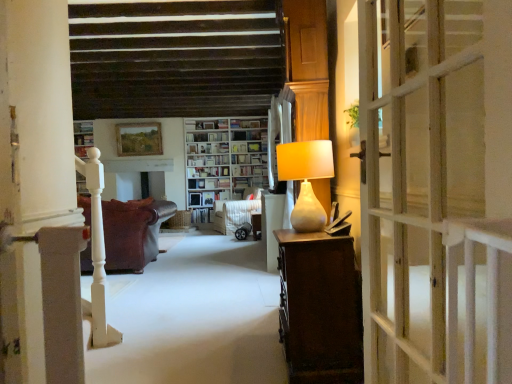
What do you see at coordinates (256, 225) in the screenshot? This screenshot has height=384, width=512. I see `wooden side table at center` at bounding box center [256, 225].

At what (x,y) coordinates should I click in order to perform the action: click on hardcover book at center, the 2th book positioned from the bottom. Please return your answer as a coordinate pair (x, y). Looking at the image, I should click on (208, 171).

Describe the element at coordinates (206, 197) in the screenshot. Image resolution: width=512 pixels, height=384 pixels. I see `hardcover book at center, acting as the first book starting from the bottom` at that location.

The height and width of the screenshot is (384, 512). In order to click on wooden cabinet at right in this screenshot , I will do `click(194, 318)`.

Measure the distance between wooden cabinet at right and camera.

wooden cabinet at right is 6.77 feet away from camera.

Find the location of a particular element. wooden picture frame at upper center is located at coordinates (139, 139).

Is leather couch at left positioned with its back to hardcover book at center, the 2th book positioned from the bottom?

No, hardcover book at center, the 2th book positioned from the bottom, is not at the back of leather couch at left.

Is leather couch at left completely or partially outside of hardcover book at center, the 2th book positioned from the bottom?

leather couch at left lies outside hardcover book at center, the 2th book positioned from the bottom,'s area.

Is leather couch at left next to hardcover book at center, which is counted as the 2th book, starting from the top?

No, leather couch at left is not in contact with hardcover book at center, which is counted as the 2th book, starting from the top.

Which object is further away from the camera, velvet brown armchair at center or hardcover book at center, acting as the first book starting from the bottom?

Positioned behind is hardcover book at center, acting as the first book starting from the bottom.

Could hardcover book at center, the 3th book from the top, be considered to be inside velvet brown armchair at center?

Definitely not — hardcover book at center, the 3th book from the top, is not inside velvet brown armchair at center.

Which of these two, velvet brown armchair at center or hardcover book at center, the 3th book from the top, stands shorter?

hardcover book at center, the 3th book from the top.

From the velvet brown armchair at center, count 1st books backward and point to it. Please provide its 2D coordinates.

[(206, 197)]

Which object is thinner, white wooden door at right or leather couch at left?

white wooden door at right.

Is point (457, 37) closer to viewer compared to point (154, 208)?

Yes, point (457, 37) is closer to viewer.

From a real-world perspective, between white wooden door at right and leather couch at left, who is vertically higher?

white wooden door at right.

Measure the distance from matte beige lamp at right to hardcover book at center, acting as the first book starting from the bottom.

The distance of matte beige lamp at right from hardcover book at center, acting as the first book starting from the bottom, is 4.31 meters.

Which point is more forward, (325, 160) or (218, 195)?

The point (325, 160) is in front.

From the image's perspective, would you say matte beige lamp at right is shown under hardcover book at center, acting as the first book starting from the bottom?

No.

Could you tell me if matte beige lamp at right is facing hardcover book at center, the 3th book from the top?

No, matte beige lamp at right is not aimed at hardcover book at center, the 3th book from the top.

Which object is closer to the camera, white wooden bookcase at center or hardcover book at center, the first book viewed from the top?

Positioned in front is white wooden bookcase at center.

Considering the sizes of white wooden bookcase at center and hardcover book at center, the third book in the bottom-to-top sequence, in the image, is white wooden bookcase at center bigger or smaller than hardcover book at center, the third book in the bottom-to-top sequence,?

white wooden bookcase at center is bigger than hardcover book at center, the third book in the bottom-to-top sequence.

From the image's perspective, is white wooden bookcase at center on hardcover book at center, the third book in the bottom-to-top sequence?

No, from the image's perspective, white wooden bookcase at center is not over hardcover book at center, the third book in the bottom-to-top sequence.

From a real-world perspective, is white wooden bookcase at center on white glossy bookshelf at center, arranged as the second shelf when viewed from the right?

No.

Between white wooden bookcase at center and white glossy bookshelf at center, the first shelf positioned from the top, which one has larger size?

white wooden bookcase at center is bigger.

Is white wooden bookcase at center completely or partially outside of white glossy bookshelf at center, arranged as the second shelf when viewed from the right?

white wooden bookcase at center is positioned outside white glossy bookshelf at center, arranged as the second shelf when viewed from the right.

Considering the relative sizes of white wooden bookcase at center and white glossy bookshelf at center, arranged as the second shelf when viewed from the right, in the image provided, is white wooden bookcase at center wider than white glossy bookshelf at center, arranged as the second shelf when viewed from the right,?

Yes, white wooden bookcase at center is wider than white glossy bookshelf at center, arranged as the second shelf when viewed from the right.

In the scene shown: Are matte beige lamp at right and wooden side table at center beside each other?

matte beige lamp at right and wooden side table at center are not in contact.

Is matte beige lamp at right turned away from wooden side table at center?

That's not correct — matte beige lamp at right is not looking away from wooden side table at center.

Considering the relative sizes of matte beige lamp at right and wooden side table at center in the image provided, is matte beige lamp at right wider than wooden side table at center?

Yes.

In the image, is matte beige lamp at right on the left side or the right side of wooden side table at center?

From the image, it's evident that matte beige lamp at right is to the right of wooden side table at center.

Locate an element on the screen. studio couch below the hardcover book at center, which is counted as the 2th book, starting from the top (from a real-world perspective) is located at coordinates (133, 232).

From the image's perspective, which book is the 1st one above the velvet brown armchair at center? Please provide its 2D coordinates.

[(206, 197)]

Estimate the real-world distances between objects in this image. Which object is further from matte beige lamp at right, wooden picture frame at upper center or white wooden bookcase at center?

Based on the image, wooden picture frame at upper center appears to be further to matte beige lamp at right.

Looking at the image, which one is located further to hardcover book at center, the 3th book from the top, hardcover book at center, the first book viewed from the top, or white glossy bookshelf at center, the first shelf positioned from the top?

The object further to hardcover book at center, the 3th book from the top, is hardcover book at center, the first book viewed from the top.

Which object lies nearer to the anchor point wooden side table at center, white glossy bookshelf at center, placed as the 1th shelf when sorted from left to right, or velvet brown armchair at center?

velvet brown armchair at center.

Considering their positions, is leather couch at left positioned further to white wooden door at right than white glossy bookshelf at center, arranged as the second shelf when viewed from the right?

Based on the image, white glossy bookshelf at center, arranged as the second shelf when viewed from the right, appears to be further to white wooden door at right.

Looking at the image, which one is located closer to white glossy bookshelf at center, the second shelf positioned from the left, hardcover book at center, the first book viewed from the top, or hardcover book at center, the 2th book positioned from the bottom?

hardcover book at center, the first book viewed from the top, is closer to white glossy bookshelf at center, the second shelf positioned from the left.

Consider the image. From the image, which object appears to be nearer to velvet brown armchair at center, white wooden door at right or wooden picture frame at upper center?

wooden picture frame at upper center is positioned closer to the anchor velvet brown armchair at center.

Based on their spatial positions, is wooden cabinet at right or hardcover book at center, the 3th book from the top, closer to hardcover book at center, which is counted as the 2th book, starting from the top?

Based on the image, hardcover book at center, the 3th book from the top, appears to be nearer to hardcover book at center, which is counted as the 2th book, starting from the top.

From the image, which object appears to be nearer to matte beige lamp at right, wooden cabinet at right or white wooden bookcase at center?

Based on the image, wooden cabinet at right appears to be nearer to matte beige lamp at right.

Find the location of a particular element. This screenshot has height=384, width=512. studio couch between wooden cabinet at right and velvet brown armchair at center from front to back is located at coordinates (133, 232).

The image size is (512, 384). I want to click on picture frame between leather couch at left and white wooden bookcase at center in the front-back direction, so click(139, 139).

Where is `shelf between hardcover book at center, the 2th book positioned from the bottom, and hardcover book at center, the third book in the bottom-to-top sequence, in the horizontal direction`? shelf between hardcover book at center, the 2th book positioned from the bottom, and hardcover book at center, the third book in the bottom-to-top sequence, in the horizontal direction is located at coordinates (207, 137).

You are a GUI agent. You are given a task and a screenshot of the screen. Output one action in this format:
    pyautogui.click(x=<x>, y=<y>)
    Task: Click on the shelf between white wooden door at right and hardcover book at center, which is counted as the 2th book, starting from the top, along the z-axis
    Image resolution: width=512 pixels, height=384 pixels.
    Given the screenshot: What is the action you would take?
    pyautogui.click(x=207, y=137)